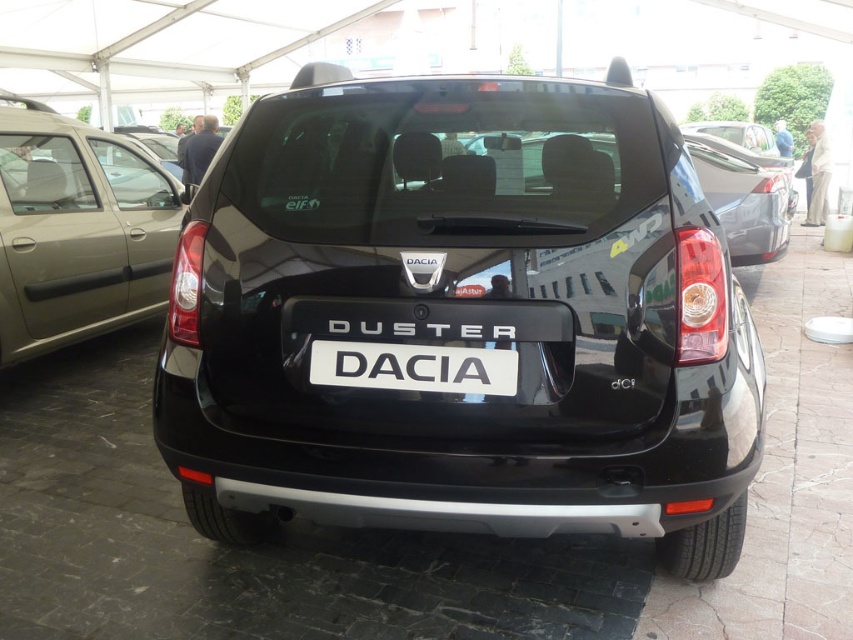
Question: Can you confirm if glossy black car at center is positioned above white plastic license plate at center?

Choices:
 (A) yes
 (B) no

Answer: (A)

Question: Considering the real-world distances, which object is farthest from the matte black minivan at left?

Choices:
 (A) white plastic license plate at center
 (B) glossy black car at center

Answer: (A)

Question: Which of the following is the farthest from the observer?

Choices:
 (A) white plastic license plate at center
 (B) matte black minivan at left

Answer: (B)

Question: Can you confirm if matte black minivan at left is thinner than white plastic license plate at center?

Choices:
 (A) yes
 (B) no

Answer: (B)

Question: Which object is the farthest from the white plastic license plate at center?

Choices:
 (A) matte black minivan at left
 (B) glossy black car at center

Answer: (A)

Question: Is glossy black car at center to the right of matte black minivan at left from the viewer's perspective?

Choices:
 (A) yes
 (B) no

Answer: (A)